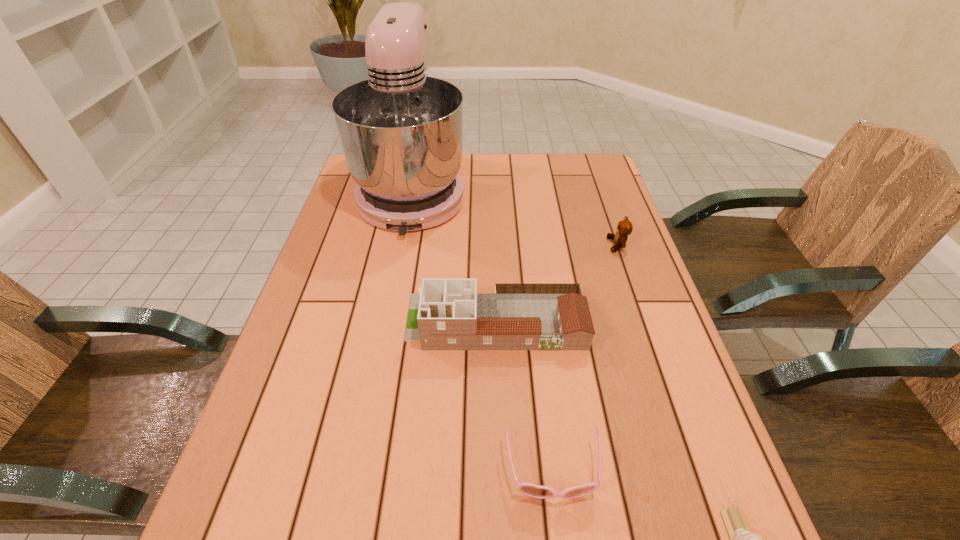
The width and height of the screenshot is (960, 540). Find the location of `vacant space located on the front-facing side of the third tallest object`. vacant space located on the front-facing side of the third tallest object is located at coordinates (497, 245).

The image size is (960, 540). I want to click on free space located 0.130m on the front-facing side of the third tallest object, so click(560, 245).

Locate an element on the screen. This screenshot has height=540, width=960. object present at the far edge is located at coordinates (401, 131).

Image resolution: width=960 pixels, height=540 pixels. Identify the location of object present at the left edge. (401, 131).

Image resolution: width=960 pixels, height=540 pixels. Identify the location of object that is positioned at the right edge. (624, 228).

You are a GUI agent. You are given a task and a screenshot of the screen. Output one action in this format:
    pyautogui.click(x=<x>, y=<y>)
    Task: Click on the object located in the far left corner section of the desktop
    
    Given the screenshot: What is the action you would take?
    pyautogui.click(x=401, y=131)

This screenshot has width=960, height=540. What are the coordinates of `vacant area at the far edge` in the screenshot? It's located at (535, 167).

The image size is (960, 540). What are the coordinates of `vacant space at the left edge` in the screenshot? It's located at (381, 248).

Find the location of `vacant space at the right edge of the desktop`. vacant space at the right edge of the desktop is located at coordinates (633, 354).

You are a GUI agent. You are given a task and a screenshot of the screen. Output one action in this format:
    pyautogui.click(x=<x>, y=<y>)
    Task: Click on the free location at the far right corner
    
    Given the screenshot: What is the action you would take?
    pyautogui.click(x=606, y=174)